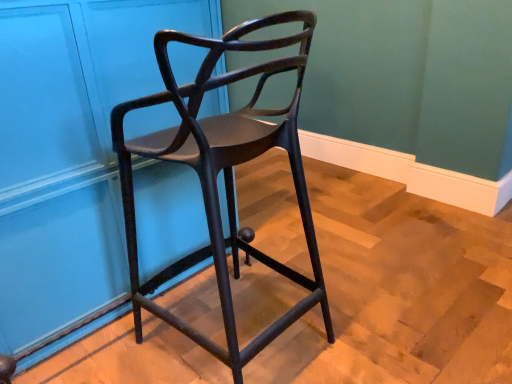
Question: Is matte blue door at upper left to the left of matte black chair at center from the viewer's perspective?

Choices:
 (A) no
 (B) yes

Answer: (B)

Question: From a real-world perspective, is matte blue door at upper left over matte black chair at center?

Choices:
 (A) yes
 (B) no

Answer: (A)

Question: Considering the relative positions of matte blue door at upper left and matte black chair at center in the image provided, is matte blue door at upper left in front of matte black chair at center?

Choices:
 (A) no
 (B) yes

Answer: (A)

Question: Is matte black chair at center at the back of matte blue door at upper left?

Choices:
 (A) no
 (B) yes

Answer: (B)

Question: Does matte blue door at upper left have a larger size compared to matte black chair at center?

Choices:
 (A) yes
 (B) no

Answer: (A)

Question: Does matte blue door at upper left have a lesser height compared to matte black chair at center?

Choices:
 (A) no
 (B) yes

Answer: (A)

Question: From a real-world perspective, is matte black chair at center located higher than matte blue door at upper left?

Choices:
 (A) no
 (B) yes

Answer: (A)

Question: Considering the relative sizes of matte black chair at center and matte blue door at upper left in the image provided, is matte black chair at center bigger than matte blue door at upper left?

Choices:
 (A) yes
 (B) no

Answer: (B)

Question: From the image's perspective, does matte black chair at center appear lower than matte blue door at upper left?

Choices:
 (A) no
 (B) yes

Answer: (B)

Question: Can you confirm if matte black chair at center is thinner than matte blue door at upper left?

Choices:
 (A) yes
 (B) no

Answer: (A)

Question: From the image's perspective, is matte black chair at center over matte blue door at upper left?

Choices:
 (A) yes
 (B) no

Answer: (B)

Question: Is matte blue door at upper left a part of matte black chair at center?

Choices:
 (A) no
 (B) yes

Answer: (A)

Question: Is point (166, 52) closer or farther from the camera than point (140, 46)?

Choices:
 (A) farther
 (B) closer

Answer: (B)